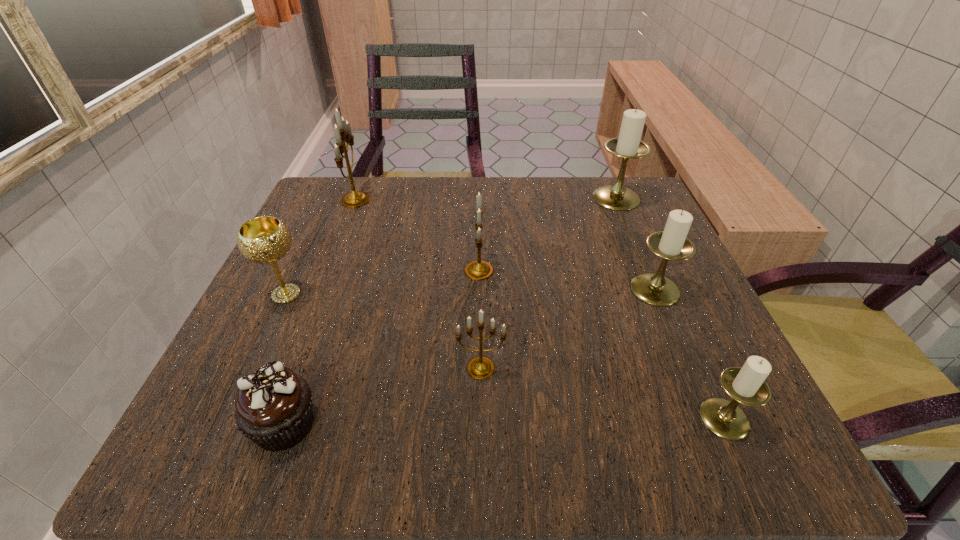
Locate an element on the screen. Image resolution: width=960 pixels, height=540 pixels. brown cupcake is located at coordinates (273, 405).

Image resolution: width=960 pixels, height=540 pixels. I want to click on the shortest object, so click(x=273, y=405).

You are a GUI agent. You are given a task and a screenshot of the screen. Output one action in this format:
    pyautogui.click(x=<x>, y=<y>)
    Task: Click on the vacant position located on the front of the farthest white candle holder
    The height and width of the screenshot is (540, 960).
    Given the screenshot: What is the action you would take?
    635,242

Locate an element on the screen. vacant space located on the front of the leftmost candle holder is located at coordinates (324, 284).

The height and width of the screenshot is (540, 960). I want to click on vacant space located 0.280m on the front of the second farthest gold candelabrum, so click(479, 435).

At what (x,y) coordinates should I click in order to perform the action: click on vacant space situated 0.360m on the back of the second smallest white candle holder. Please return your answer as a coordinate pair (x, y). This screenshot has height=540, width=960. Looking at the image, I should click on (607, 176).

Where is `vacant space positioned on the back of the chalice`? This screenshot has height=540, width=960. vacant space positioned on the back of the chalice is located at coordinates (316, 231).

Where is `vacant space located on the front of the sixth farthest object`? The height and width of the screenshot is (540, 960). vacant space located on the front of the sixth farthest object is located at coordinates (481, 410).

Identify the location of free location located on the back of the smallest white candle holder. Image resolution: width=960 pixels, height=540 pixels. (666, 289).

Where is `vacant region located 0.200m on the back of the brown cupcake`? vacant region located 0.200m on the back of the brown cupcake is located at coordinates 331,295.